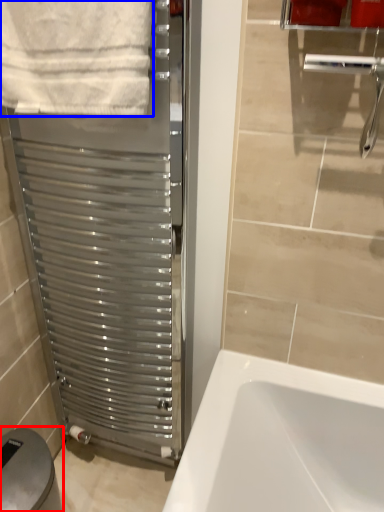
Question: Which object appears farthest to the camera in this image, gray (highlighted by a red box) or towel (highlighted by a blue box)?

Choices:
 (A) gray
 (B) towel

Answer: (A)